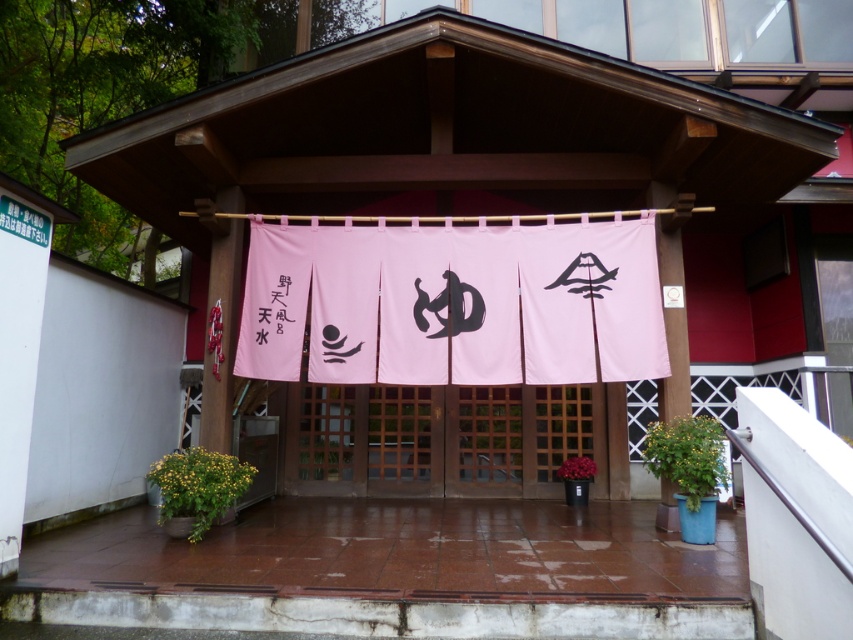
You are a visitor approaching the entrance of the traditional Japanese building. You notice the pink fabric banner at center and the black paper at left. Which object is nearer to you as you stand at the entrance?

The pink fabric banner at center is closer to the viewer than the black paper at left, so the pink fabric banner at center is nearer to you as you stand at the entrance.

You are a visitor approaching the entrance of this traditional Japanese building. You notice two items near the entrance. Which one is larger in size between the pink fabric banner at center and the black paper at left?

The pink fabric banner at center is bigger than the black paper at left, so the pink fabric banner at center is larger in size.

You are a guest approaching the entrance of this traditional Japanese building. You see the pink fabric banner at center and the black paper at left. Which object is located to the right of the other?

The pink fabric banner at center is positioned on the right side of black paper at left.